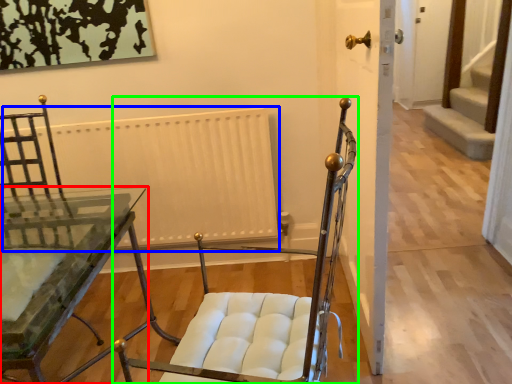
Question: Based on their relative distances, which object is nearer to table (highlighted by a red box)? Choose from radiator (highlighted by a blue box) and chair (highlighted by a green box).

Choices:
 (A) radiator
 (B) chair

Answer: (A)